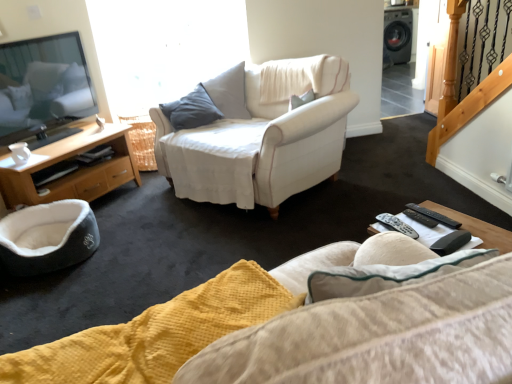
Locate an element on the screen. This screenshot has width=512, height=384. blank space situated above black plastic remote control at lower right (from a real-world perspective) is located at coordinates (430, 233).